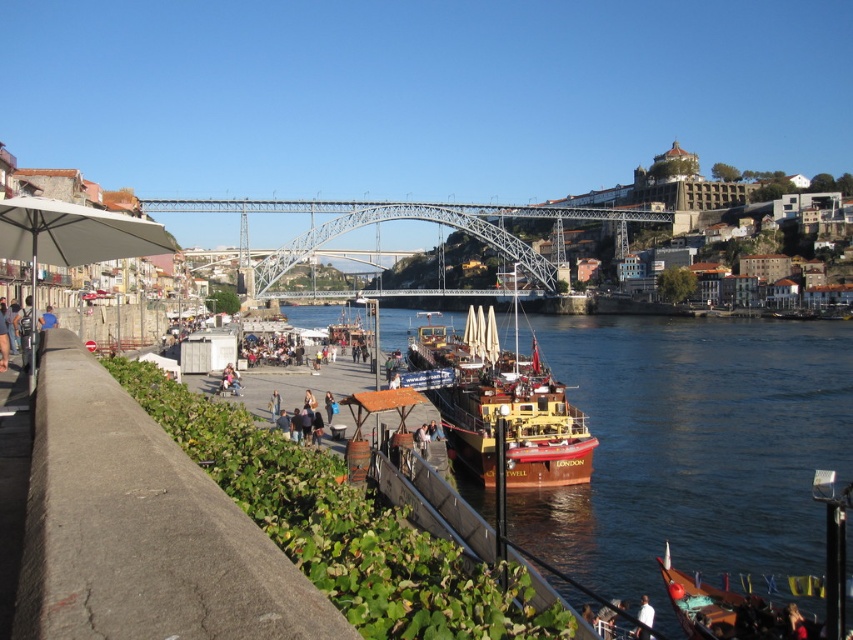
Who is lower down, brown wooden boat at center or light brown leather jacket at center?

light brown leather jacket at center is lower down.

Does brown wooden boat at center come behind light brown leather jacket at center?

No, brown wooden boat at center is in front of light brown leather jacket at center.

Who is more forward, (784, 340) or (274, 408)?

Point (274, 408) is in front.

The width and height of the screenshot is (853, 640). Find the location of `brown wooden boat at center`. brown wooden boat at center is located at coordinates (693, 449).

Is metallic steel bridge at center shorter than wooden polished boat at lower right?

Incorrect, metallic steel bridge at center's height does not fall short of wooden polished boat at lower right's.

Between point (312, 224) and point (735, 605), which one is positioned in front?

Point (735, 605)

Does point (381, 209) lie behind point (735, 621)?

Yes.

The height and width of the screenshot is (640, 853). In order to click on metallic steel bridge at center in this screenshot , I will do `click(404, 220)`.

Is brown wooden boat at center further to the viewer compared to white fabric shirt at lower right?

Yes.

This screenshot has height=640, width=853. What do you see at coordinates (693, 449) in the screenshot?
I see `brown wooden boat at center` at bounding box center [693, 449].

At what (x,y) coordinates should I click in order to perform the action: click on brown wooden boat at center. Please return your answer as a coordinate pair (x, y). This screenshot has height=640, width=853. Looking at the image, I should click on (693, 449).